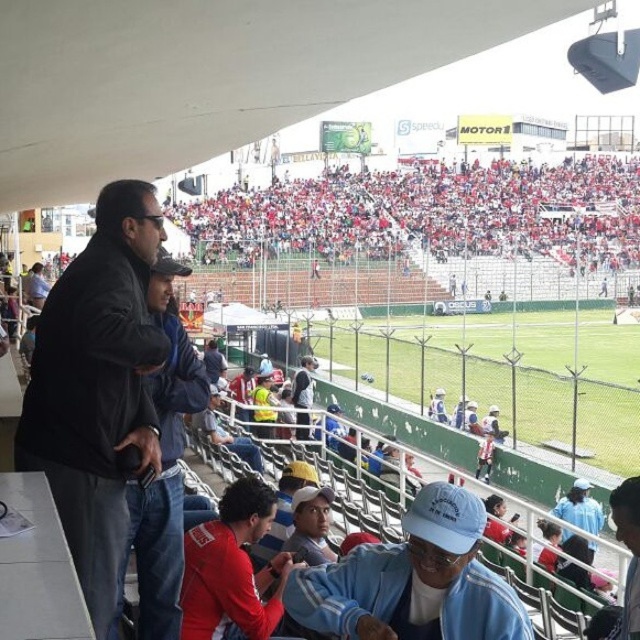
Is the position of red fabric seats at upper center more distant than that of dark blue jacket at center?

Yes, it is.

How distant is red fabric seats at upper center from dark blue jacket at center?

red fabric seats at upper center and dark blue jacket at center are 97.46 meters apart from each other.

Is point (422, 241) positioned behind point (140, 554)?

That is True.

Image resolution: width=640 pixels, height=640 pixels. What are the coordinates of `red fabric seats at upper center` in the screenshot? It's located at (429, 214).

Which is in front, point (156, 307) or point (268, 612)?

Positioned in front is point (268, 612).

This screenshot has width=640, height=640. Describe the element at coordinates (164, 464) in the screenshot. I see `dark blue jacket at center` at that location.

Looking at this image, who is more distant from viewer, (144, 628) or (189, 637)?

The point (189, 637) is more distant.

Locate an element on the screen. This screenshot has height=640, width=640. dark blue jacket at center is located at coordinates (164, 464).

Based on the photo, between light blue fabric jacket at lower center and dark blue jacket at center, which one appears on the left side from the viewer's perspective?

dark blue jacket at center is more to the left.

Locate an element on the screen. The height and width of the screenshot is (640, 640). light blue fabric jacket at lower center is located at coordinates (413, 580).